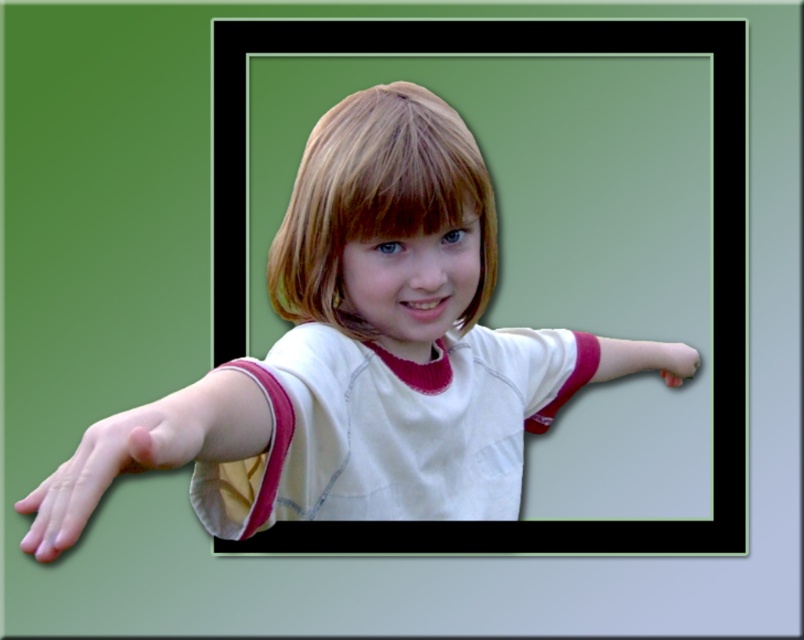
Does point (362, 224) come closer to viewer compared to point (665, 364)?

Yes, point (362, 224) is closer to viewer.

Can you confirm if blonde smooth hair at center is taller than pink matte hand at lower right?

Correct, blonde smooth hair at center is much taller as pink matte hand at lower right.

Does point (314, 282) come closer to viewer compared to point (695, 349)?

Yes, it is in front of point (695, 349).

Where is `blonde smooth hair at center`? The width and height of the screenshot is (804, 640). blonde smooth hair at center is located at coordinates (376, 198).

Is pink fabric arm at lower left to the left of smooth skin hand at lower left from the viewer's perspective?

Incorrect, pink fabric arm at lower left is not on the left side of smooth skin hand at lower left.

Where is `pink fabric arm at lower left`? pink fabric arm at lower left is located at coordinates (146, 451).

Locate an element on the screen. The width and height of the screenshot is (804, 640). pink fabric arm at lower left is located at coordinates (146, 451).

The width and height of the screenshot is (804, 640). I want to click on pink fabric arm at lower left, so click(146, 451).

Between white cotton shirt at center and pink fabric arm at lower left, which one is positioned lower?

pink fabric arm at lower left is below.

Is white cotton shirt at center to the left of pink fabric arm at lower left from the viewer's perspective?

No, white cotton shirt at center is not to the left of pink fabric arm at lower left.

I want to click on white cotton shirt at center, so tap(355, 360).